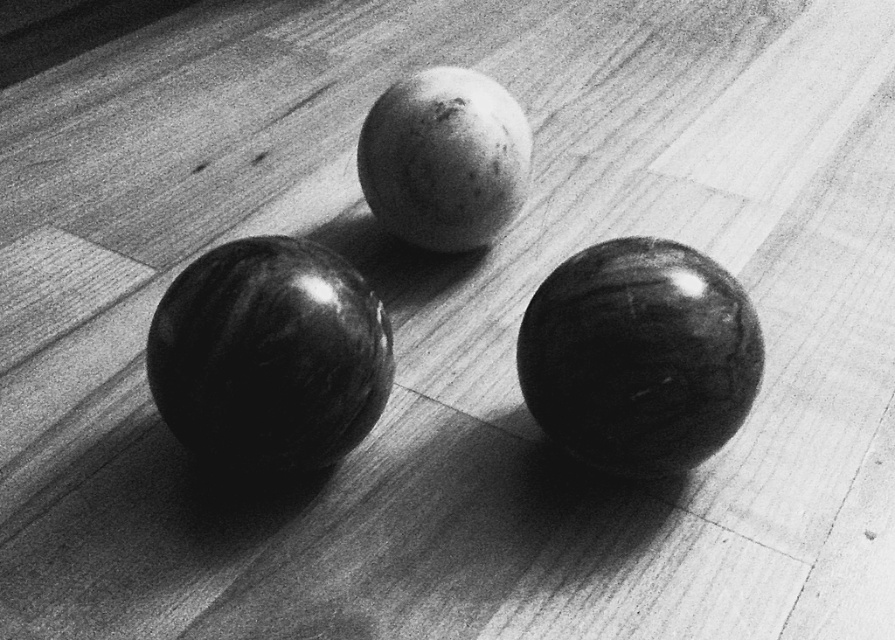
Question: Is shiny black bowling ball at center closer to the viewer compared to glossy black bowling ball at lower right?

Choices:
 (A) no
 (B) yes

Answer: (B)

Question: Which object is the farthest from the shiny black bowling ball at center?

Choices:
 (A) glossy black bowling ball at lower right
 (B) matte white bowling ball at center

Answer: (B)

Question: Based on their relative distances, which object is nearer to the glossy black bowling ball at lower right?

Choices:
 (A) shiny black bowling ball at center
 (B) matte white bowling ball at center

Answer: (A)

Question: Can you confirm if shiny black bowling ball at center is positioned to the left of matte white bowling ball at center?

Choices:
 (A) yes
 (B) no

Answer: (A)

Question: Is shiny black bowling ball at center below glossy black bowling ball at lower right?

Choices:
 (A) no
 (B) yes

Answer: (A)

Question: Estimate the real-world distances between objects in this image. Which object is farther from the shiny black bowling ball at center?

Choices:
 (A) matte white bowling ball at center
 (B) glossy black bowling ball at lower right

Answer: (A)